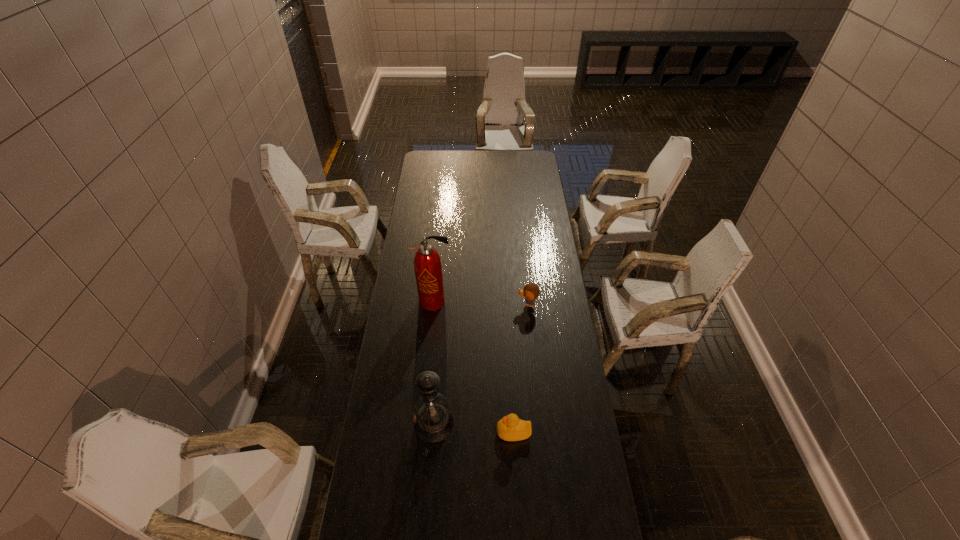
What are the coordinates of `the second closest object relative to the nearer duck` in the screenshot? It's located at (531, 291).

The width and height of the screenshot is (960, 540). I want to click on object that can be found as the second closest to the tallest object, so click(433, 422).

The height and width of the screenshot is (540, 960). Identify the location of blank area in the image that satisfies the following two spatial constraints: 1. on the front side of the fire extinguisher; 2. on the left side of the second tallest object. (422, 423).